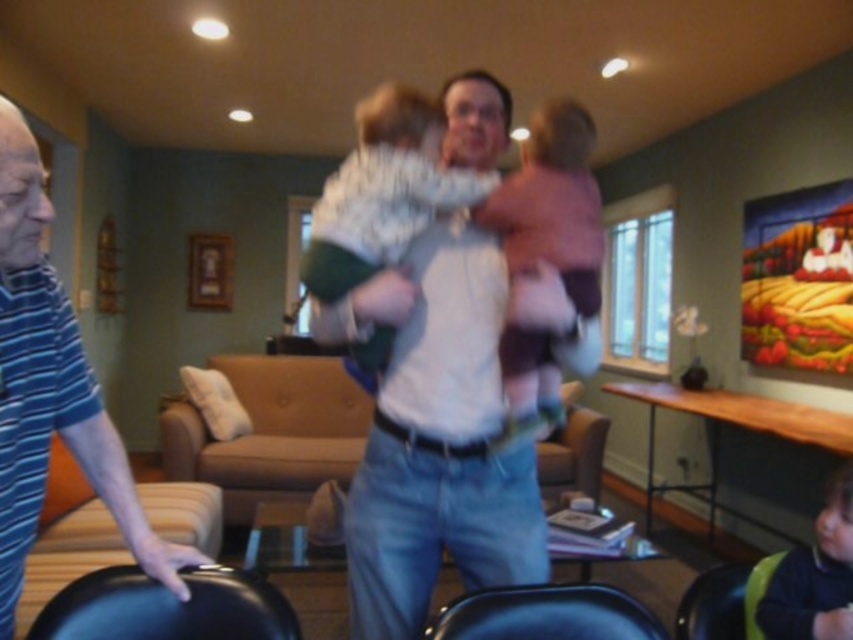
You are a photographer setting up a shoot in this living room. You need to place a 1.8 meter tall tripod between the black leather chair at lower left and the black leather chair at lower center. Considering their heights, will the tripod fit vertically between them without touching either chair?

The black leather chair at lower left is much taller than the black leather chair at lower center. Since the tripod is 1.8 meters tall, it might not fit vertically between them if the taller chair obstructs the space. However, the exact vertical clearance isn

You are trying to decide which sweater to take from the living room. Both the white knit sweater at center and the dark green sweater at lower right are on the couch. Which one is taller?

The white knit sweater at center is taller than the dark green sweater at lower right.

You are a photographer who needs to adjust the lighting to focus on the white knit sweater at center and the dark green sweater at lower right. Which sweater should you adjust the lighting above to ensure the one below is properly lit?

The white knit sweater at center is located above the dark green sweater at lower right. To ensure proper lighting, adjust the lighting above the white knit sweater at center so that the light naturally falls downward onto the dark green sweater at lower right.